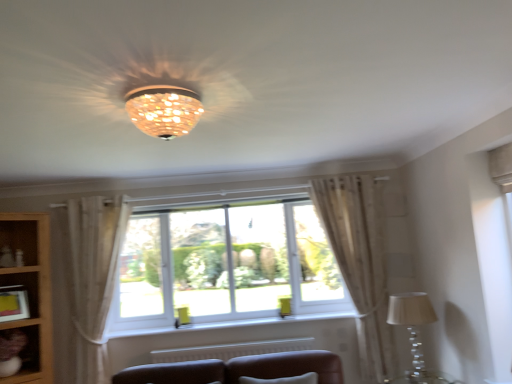
Question: Is white plastic window at center taller or shorter than matte brown shelf at lower left?

Choices:
 (A) short
 (B) tall

Answer: (B)

Question: Do you think white plastic window at center is within matte brown shelf at lower left, or outside of it?

Choices:
 (A) outside
 (B) inside

Answer: (A)

Question: Estimate the real-world distances between objects in this image. Which object is closer to the white plastic window at center?

Choices:
 (A) matte yellow picture frame at lower left
 (B) white plastic window sill at center
 (C) matte brown shelf at lower left
 (D) translucent glass table lamp at lower right
 (E) wooden bookshelf at lower left

Answer: (B)

Question: Which is nearer to the wooden bookshelf at lower left?

Choices:
 (A) sheer beige curtain at lower left, which is the first curtain in left-to-right order
 (B) white plastic window at center
 (C) translucent glass table lamp at lower right
 (D) matte brown shelf at lower left
 (E) matte glass chandelier at center

Answer: (D)